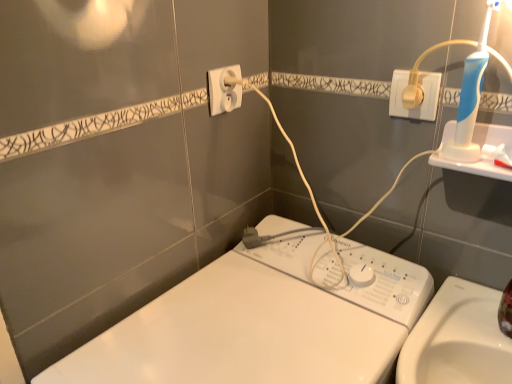
Question: Is white plastic washing machine at center in front of or behind white plastic plug at upper right, arranged as the first power plugs and sockets when viewed from the right, in the image?

Choices:
 (A) front
 (B) behind

Answer: (A)

Question: Considering the positions of point (199, 372) and point (391, 89), is point (199, 372) closer or farther from the camera than point (391, 89)?

Choices:
 (A) farther
 (B) closer

Answer: (B)

Question: Based on their relative distances, which object is farther from the white plastic socket at upper center, the 1th power plugs and sockets positioned from the left?

Choices:
 (A) white plastic washing machine at center
 (B) white plastic plug at upper right, which is the 2th power plugs and sockets in left-to-right order

Answer: (A)

Question: Estimate the real-world distances between objects in this image. Which object is farther from the white plastic washing machine at center?

Choices:
 (A) white plastic socket at upper center, the 1th power plugs and sockets positioned from the left
 (B) white plastic plug at upper right, arranged as the first power plugs and sockets when viewed from the right

Answer: (B)